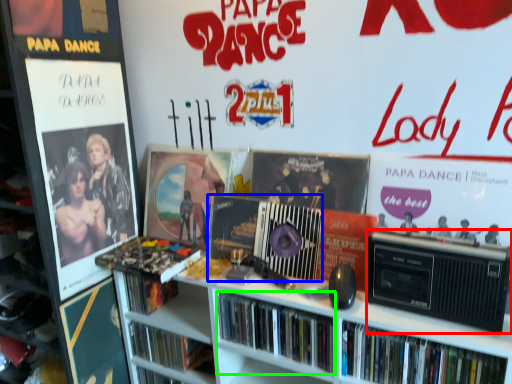
Question: Which object is positioned farthest from cassette (highlighted by a red box)? Select from cassette (highlighted by a blue box) and book (highlighted by a green box).

Choices:
 (A) cassette
 (B) book

Answer: (A)